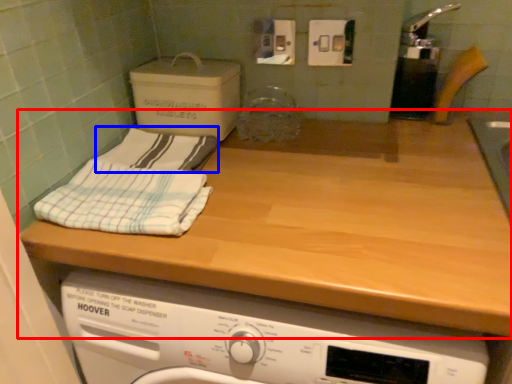
Question: Which point is further to the camera, countertop (highlighted by a red box) or bath towel (highlighted by a blue box)?

Choices:
 (A) countertop
 (B) bath towel

Answer: (B)